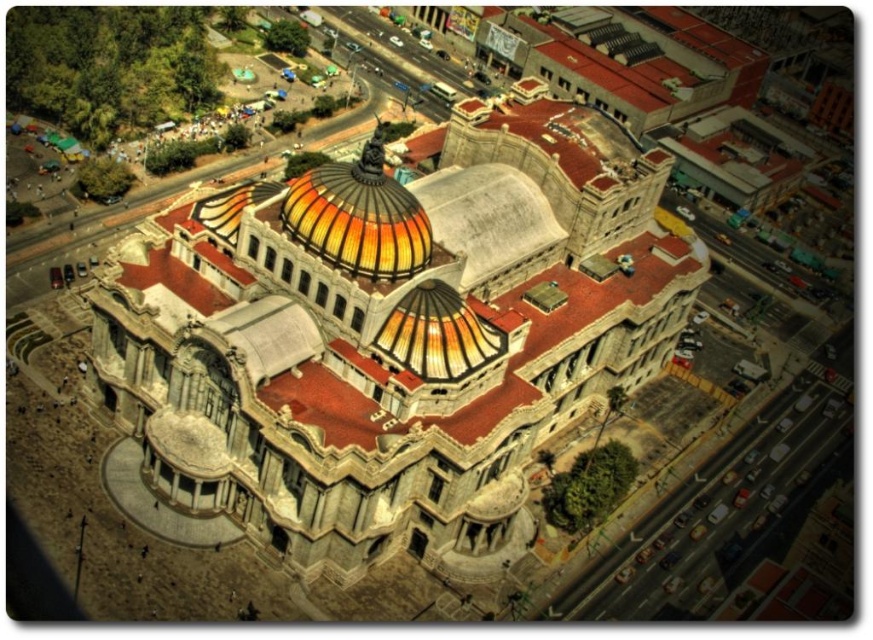
Question: Is matte stone church at center wider than translucent glass dome at center?

Choices:
 (A) yes
 (B) no

Answer: (A)

Question: Which of the following is the farthest from the observer?

Choices:
 (A) (229, 404)
 (B) (377, 216)

Answer: (B)

Question: Which of the following is the closest to the observer?

Choices:
 (A) translucent glass dome at center
 (B) matte stone church at center

Answer: (B)

Question: Which of the following is the farthest from the observer?

Choices:
 (A) translucent glass dome at center
 (B) matte stone church at center

Answer: (A)

Question: Does matte stone church at center have a lesser width compared to translucent glass dome at center?

Choices:
 (A) no
 (B) yes

Answer: (A)

Question: Does matte stone church at center lie in front of translucent glass dome at center?

Choices:
 (A) yes
 (B) no

Answer: (A)